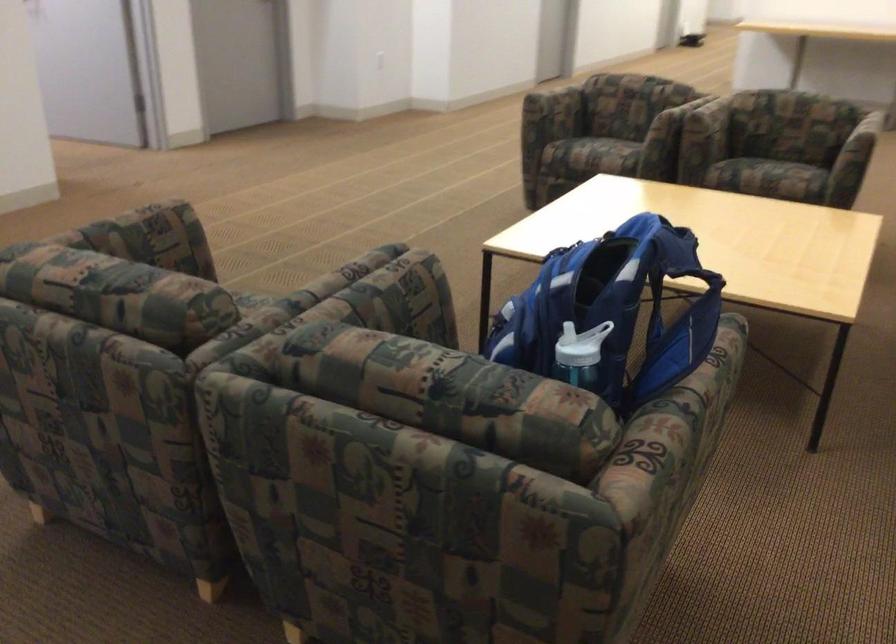
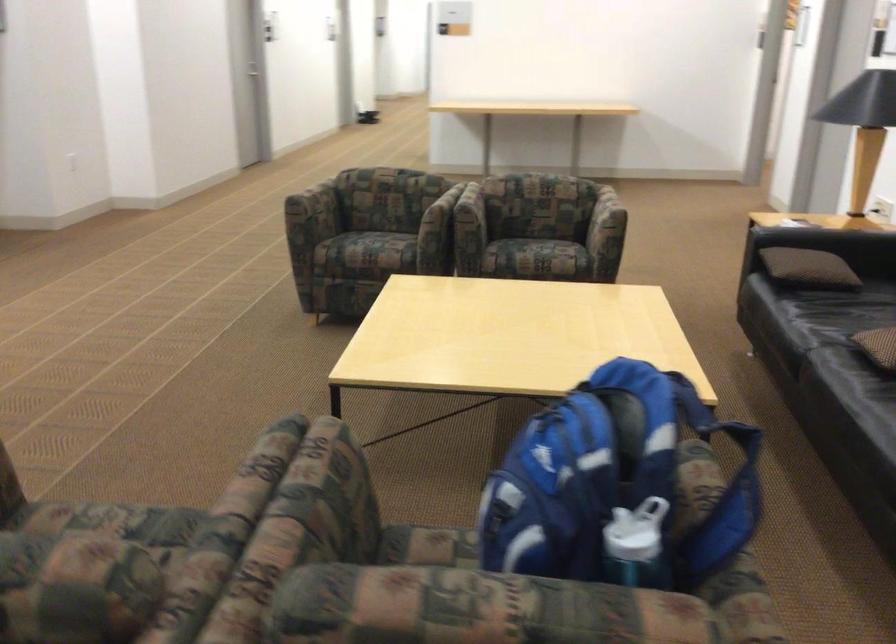
Based on the photo, the images are taken continuously from a first-person perspective. In which direction are you moving?

The cameraman moved toward left, forward.